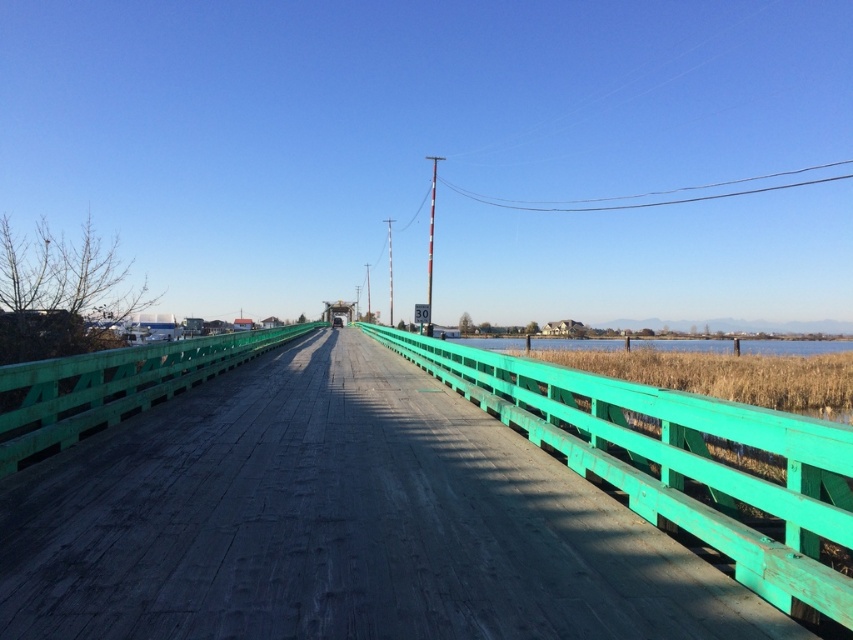
Question: Is green wooden bridge at center below green wooden water at center?

Choices:
 (A) no
 (B) yes

Answer: (A)

Question: Which point is farther to the camera?

Choices:
 (A) green wooden water at center
 (B) green wooden bridge at center

Answer: (A)

Question: Where is green wooden bridge at center located in relation to green wooden water at center in the image?

Choices:
 (A) above
 (B) below

Answer: (A)

Question: Does green wooden bridge at center have a lesser width compared to green wooden water at center?

Choices:
 (A) yes
 (B) no

Answer: (A)